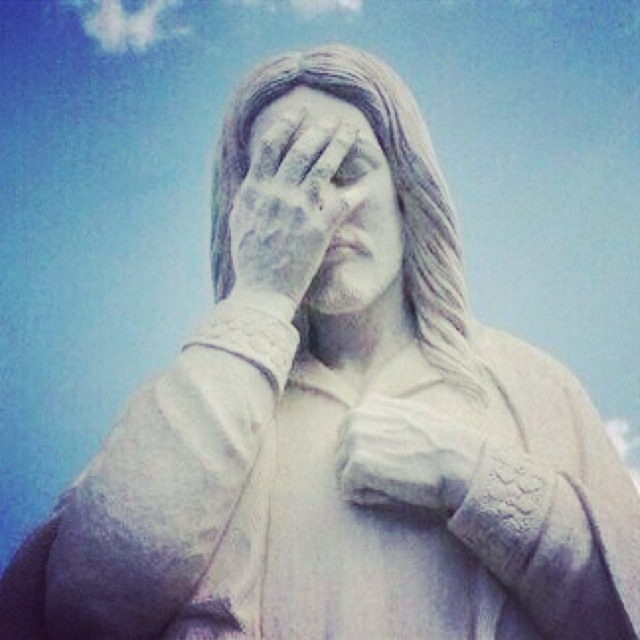
Can you confirm if white stone face at center is thinner than white stone hand at center?

No, white stone face at center is not thinner than white stone hand at center.

Does white stone face at center appear over white stone hand at center?

Correct, white stone face at center is located above white stone hand at center.

Between point (388, 228) and point (403, 436), which one is positioned in front?

Point (403, 436) is more forward.

Image resolution: width=640 pixels, height=640 pixels. I want to click on white stone face at center, so click(x=316, y=208).

Can you confirm if white stone face at center is positioned to the right of white marble eye at center?

Incorrect, white stone face at center is not on the right side of white marble eye at center.

Which of these two, white stone face at center or white marble eye at center, stands taller?

white stone face at center

This screenshot has height=640, width=640. Describe the element at coordinates (316, 208) in the screenshot. I see `white stone face at center` at that location.

At what (x,y) coordinates should I click in order to perform the action: click on white stone face at center. Please return your answer as a coordinate pair (x, y). Looking at the image, I should click on (316, 208).

Who is more forward, [401,500] or [372,163]?

Point [401,500] is in front.

Which is more to the right, white stone hand at center or white marble eye at center?

white stone hand at center is more to the right.

This screenshot has height=640, width=640. In order to click on white stone hand at center in this screenshot , I will do `click(406, 454)`.